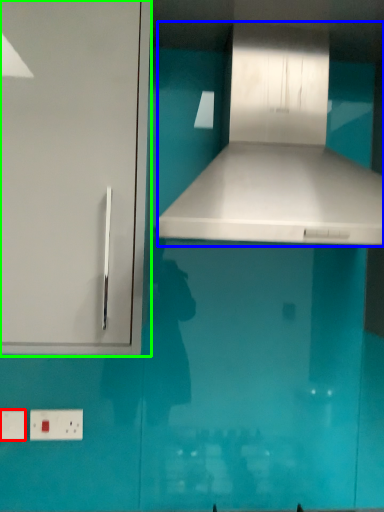
Question: Based on their relative distances, which object is farther from electric outlet (highlighted by a red box)? Choose from vent (highlighted by a blue box) and cabinetry (highlighted by a green box).

Choices:
 (A) vent
 (B) cabinetry

Answer: (A)